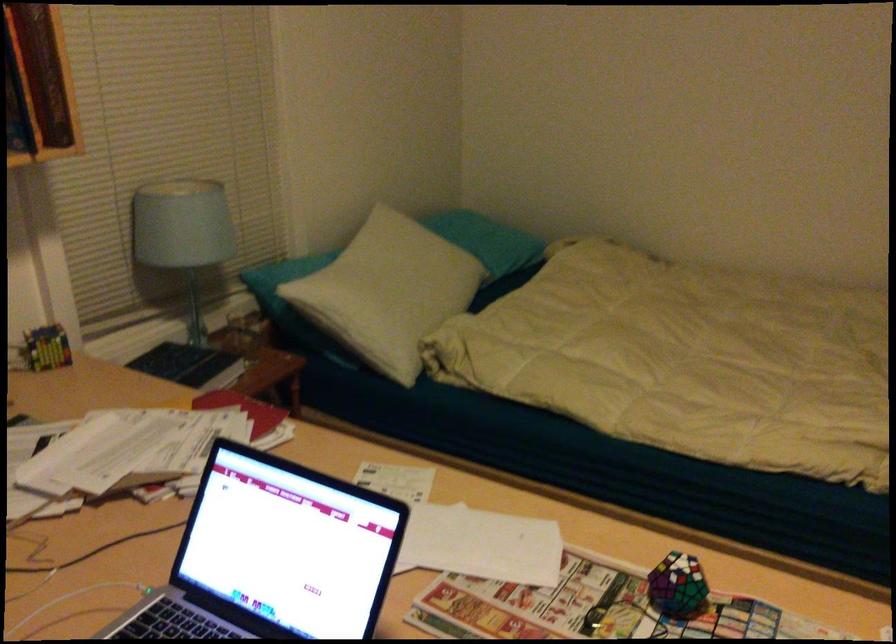
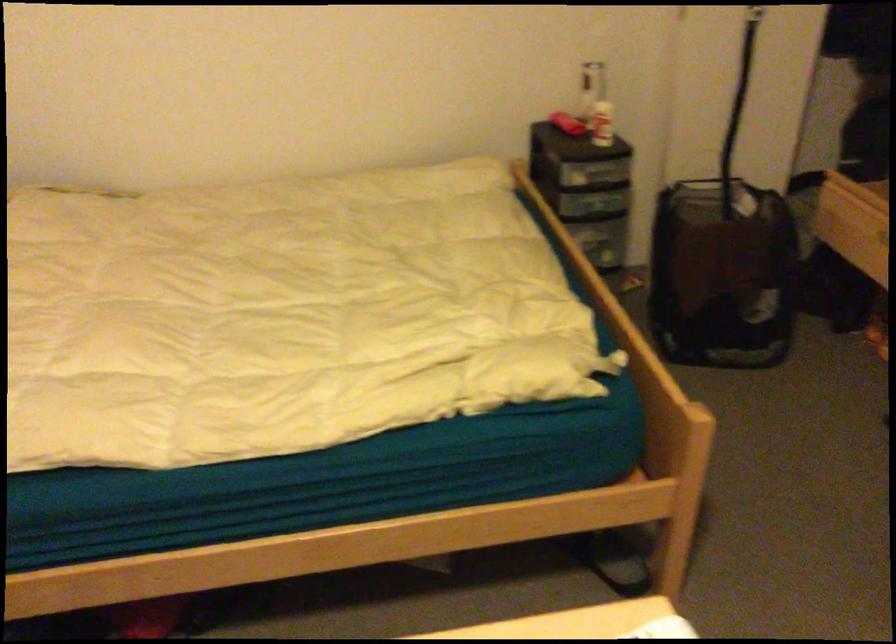
Question: The first image is from the beginning of the video and the second image is from the end. How did the camera likely rotate when shooting the video?

Choices:
 (A) Left
 (B) Right
 (C) Up
 (D) Down

Answer: (B)